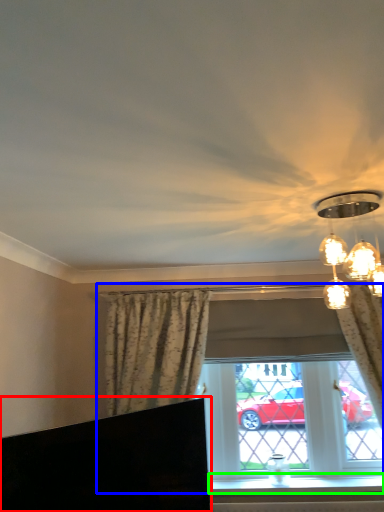
Question: Which object is positioned closest to furniture (highlighted by a red box)? Select from window (highlighted by a blue box) and window sill (highlighted by a green box).

Choices:
 (A) window
 (B) window sill

Answer: (A)